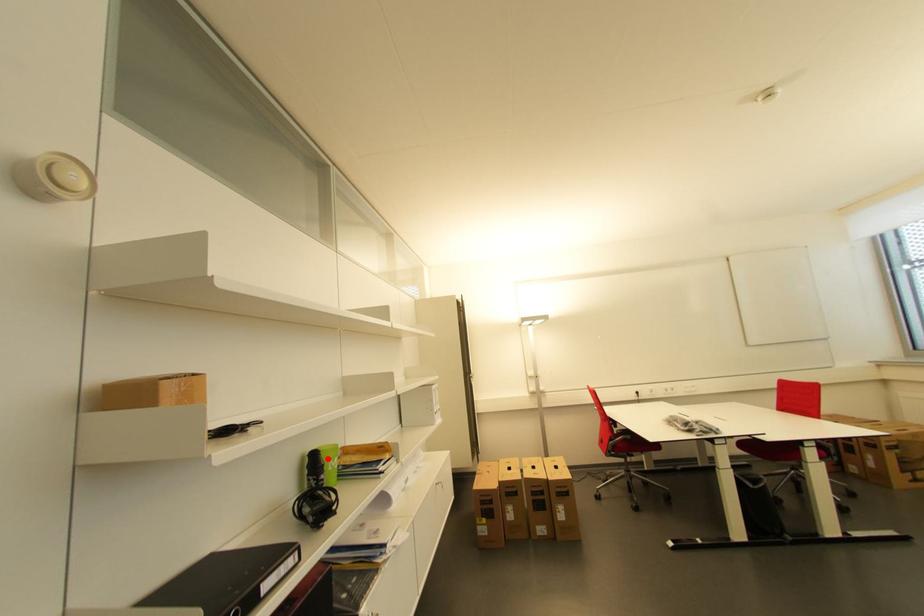
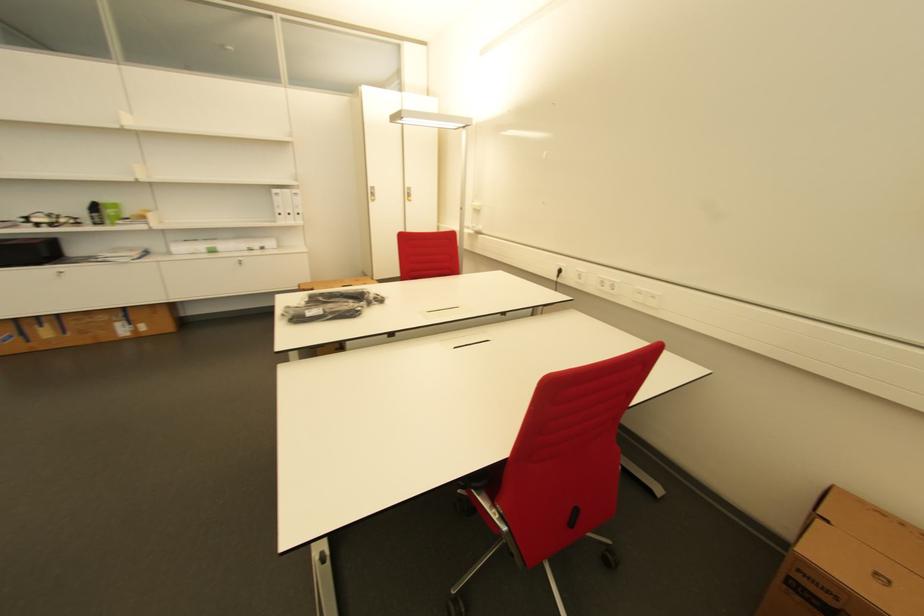
The point at the highlighted location is marked in the first image. Where is the corresponding point in the second image?

(104, 208)